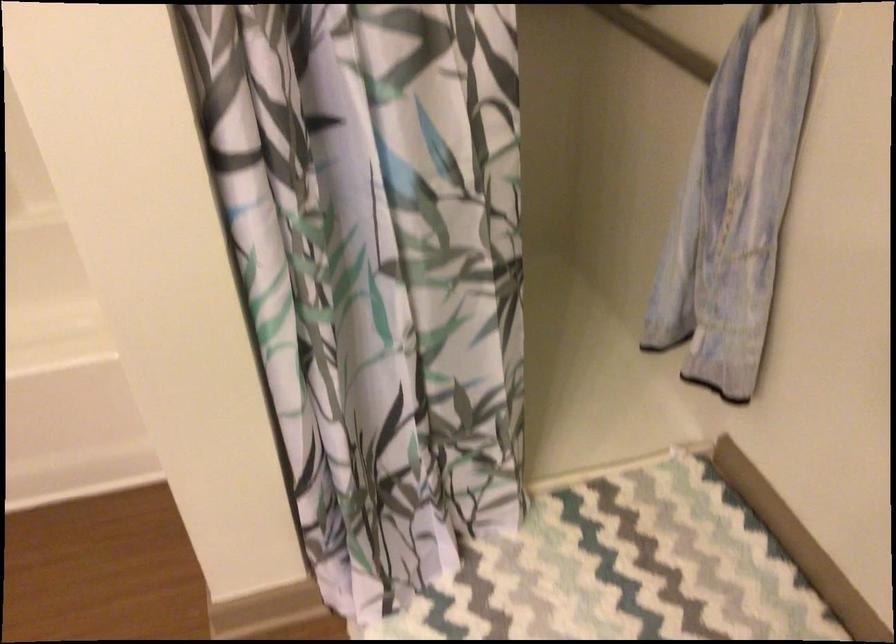
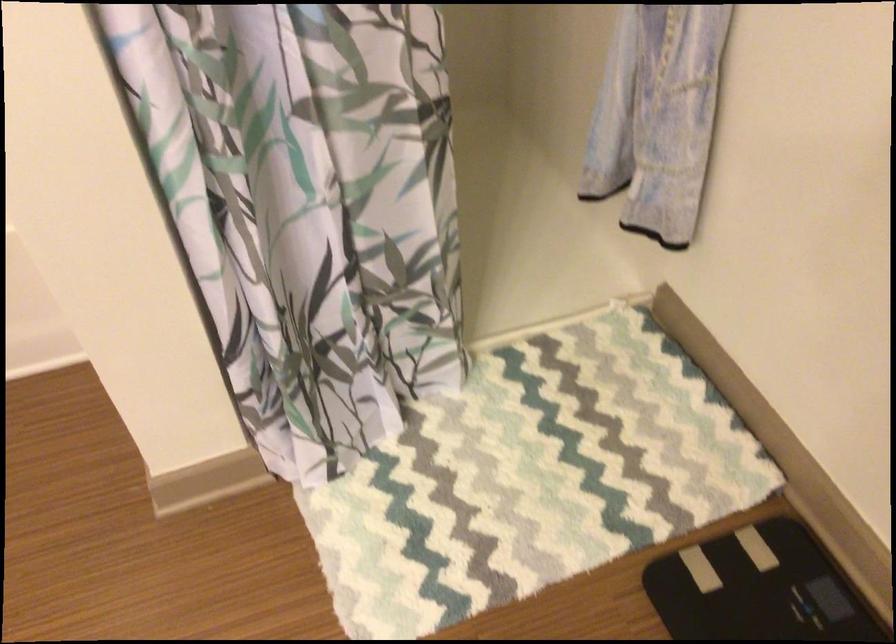
In a continuous first-person perspective shot, in which direction is the camera moving?

The cameraman walked toward right, forward.